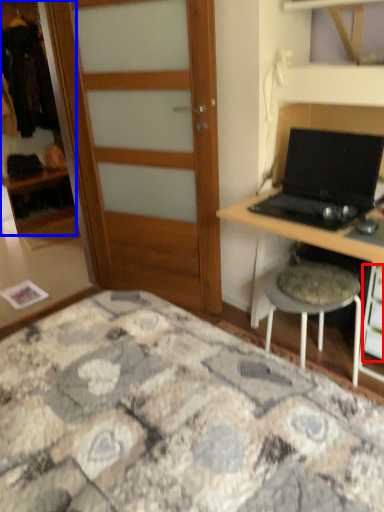
Question: Which object is further to the camera taking this photo, drawer (highlighted by a red box) or cabinetry (highlighted by a blue box)?

Choices:
 (A) drawer
 (B) cabinetry

Answer: (B)